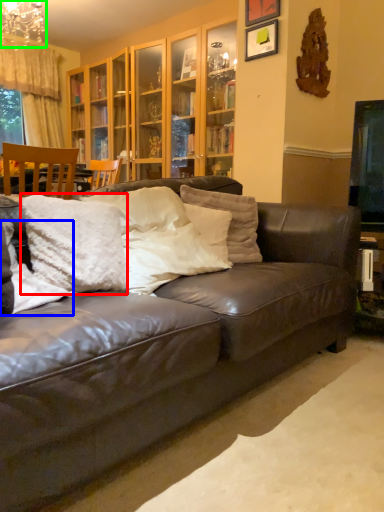
Question: Which object is the closest to the pillow (highlighted by a red box)? Choose among these: pillow (highlighted by a blue box) or chandelier (highlighted by a green box).

Choices:
 (A) pillow
 (B) chandelier

Answer: (A)